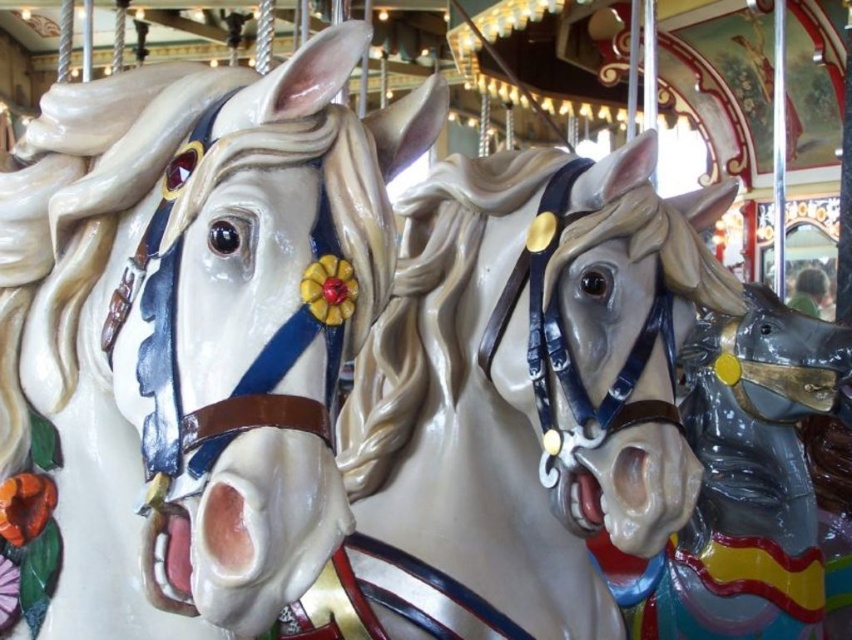
Question: Which object appears closest to the camera in this image?

Choices:
 (A) shiny gold bridle at center
 (B) matte white horse at center
 (C) glossy plastic horse at center

Answer: (B)

Question: Which of the following is the farthest from the observer?

Choices:
 (A) matte white horse at center
 (B) shiny gold bridle at center

Answer: (B)

Question: Which object is farther from the camera taking this photo?

Choices:
 (A) glossy plastic horse at center
 (B) matte white horse at center
 (C) shiny gold bridle at center

Answer: (A)

Question: Does matte white horse at center have a larger size compared to shiny gold bridle at center?

Choices:
 (A) yes
 (B) no

Answer: (B)

Question: Is shiny gold bridle at center further to the viewer compared to glossy plastic horse at center?

Choices:
 (A) no
 (B) yes

Answer: (A)

Question: Does matte white horse at center appear over shiny gold bridle at center?

Choices:
 (A) yes
 (B) no

Answer: (A)